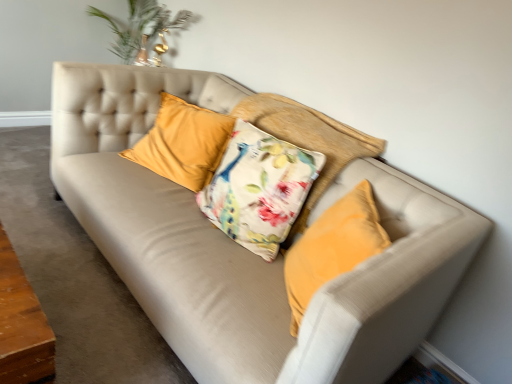
Question: Is velvet yellow pillow at center, marked as the 2th pillow in a right-to-left arrangement, looking in the opposite direction of suede beige couch at center?

Choices:
 (A) yes
 (B) no

Answer: (B)

Question: Is velvet yellow pillow at center, the first pillow positioned from the left, positioned beyond the bounds of suede beige couch at center?

Choices:
 (A) yes
 (B) no

Answer: (A)

Question: From a real-world perspective, is velvet yellow pillow at center, marked as the 2th pillow in a right-to-left arrangement, located beneath suede beige couch at center?

Choices:
 (A) yes
 (B) no

Answer: (B)

Question: Is there a large distance between velvet yellow pillow at center, the first pillow positioned from the left, and suede beige couch at center?

Choices:
 (A) no
 (B) yes

Answer: (A)

Question: Does velvet yellow pillow at center, the first pillow positioned from the left, come behind suede beige couch at center?

Choices:
 (A) yes
 (B) no

Answer: (A)

Question: Based on their positions, is suede beige couch at center located to the left or right of velvet yellow pillow at center, the first pillow positioned from the left?

Choices:
 (A) right
 (B) left

Answer: (B)

Question: From a real-world perspective, is suede beige couch at center above or below velvet yellow pillow at center, the first pillow positioned from the left?

Choices:
 (A) below
 (B) above

Answer: (A)

Question: Relative to velvet yellow pillow at center, marked as the 2th pillow in a right-to-left arrangement, is suede beige couch at center in front or behind?

Choices:
 (A) behind
 (B) front

Answer: (B)

Question: Is suede beige couch at center spatially inside velvet yellow pillow at center, the first pillow positioned from the left, or outside of it?

Choices:
 (A) inside
 (B) outside

Answer: (B)

Question: From a real-world perspective, relative to suede beige couch at center, is floral fabric cushion at center, the 1th pillow from the right, vertically above or below?

Choices:
 (A) above
 (B) below

Answer: (A)

Question: In terms of width, does floral fabric cushion at center, the 2th pillow in the left-to-right sequence, look wider or thinner when compared to suede beige couch at center?

Choices:
 (A) wide
 (B) thin

Answer: (B)

Question: From their relative heights in the image, would you say floral fabric cushion at center, the 1th pillow from the right, is taller or shorter than suede beige couch at center?

Choices:
 (A) short
 (B) tall

Answer: (B)

Question: Is floral fabric cushion at center, the 2th pillow in the left-to-right sequence, in front of or behind suede beige couch at center in the image?

Choices:
 (A) front
 (B) behind

Answer: (B)

Question: From their relative heights in the image, would you say velvet yellow pillow at center, marked as the 2th pillow in a right-to-left arrangement, is taller or shorter than suede beige couch at center?

Choices:
 (A) short
 (B) tall

Answer: (B)

Question: Is velvet yellow pillow at center, marked as the 2th pillow in a right-to-left arrangement, in front of or behind suede beige couch at center in the image?

Choices:
 (A) behind
 (B) front

Answer: (A)